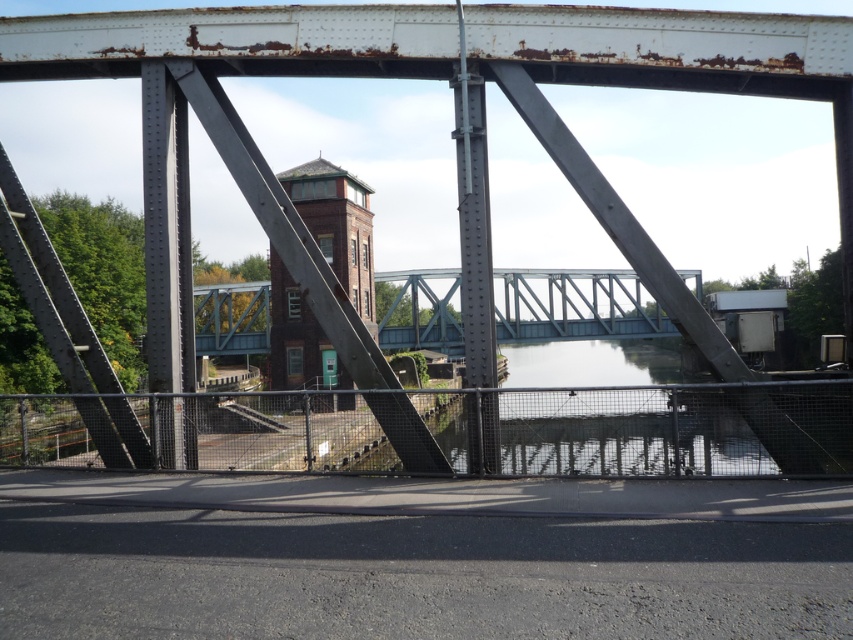
Question: Based on their relative distances, which object is nearer to the metallic gray bridge at center?

Choices:
 (A) brown brick tower at center
 (B) rusty metal train bridge at center

Answer: (A)

Question: Is metallic gray bridge at center smaller than brown brick tower at center?

Choices:
 (A) yes
 (B) no

Answer: (B)

Question: Which of the following is the closest to the observer?

Choices:
 (A) (318, 289)
 (B) (599, 317)
 (C) (347, 278)

Answer: (A)

Question: Observing the image, what is the correct spatial positioning of rusty metal train bridge at center in reference to metallic gray bridge at center?

Choices:
 (A) below
 (B) above

Answer: (B)

Question: Which object is the closest to the metallic gray bridge at center?

Choices:
 (A) rusty metal train bridge at center
 (B) brown brick tower at center

Answer: (B)

Question: Observing the image, what is the correct spatial positioning of rusty metal train bridge at center in reference to metallic gray bridge at center?

Choices:
 (A) below
 (B) above

Answer: (B)